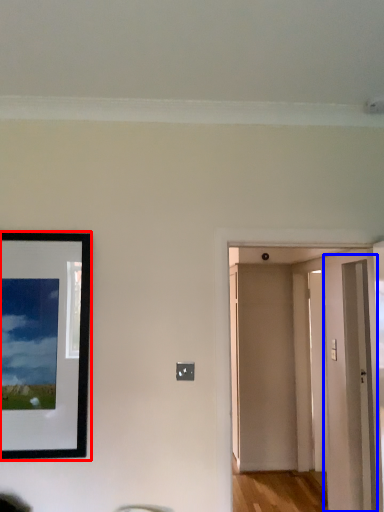
Question: Which object appears farthest to the camera in this image, picture frame (highlighted by a red box) or glass door (highlighted by a blue box)?

Choices:
 (A) picture frame
 (B) glass door

Answer: (B)